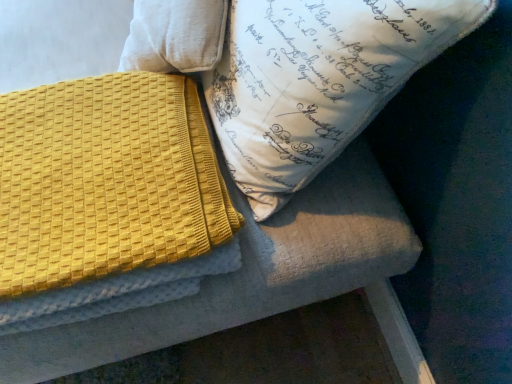
Identify the location of yellow textured blanket at upper left. The width and height of the screenshot is (512, 384). (108, 199).

Image resolution: width=512 pixels, height=384 pixels. What do you see at coordinates (108, 199) in the screenshot?
I see `yellow textured blanket at upper left` at bounding box center [108, 199].

Find the location of a particular element. white printed pillow at upper center is located at coordinates (317, 80).

What do you see at coordinates (317, 80) in the screenshot? Image resolution: width=512 pixels, height=384 pixels. I see `white printed pillow at upper center` at bounding box center [317, 80].

This screenshot has width=512, height=384. I want to click on yellow textured blanket at upper left, so click(108, 199).

Between yellow textured blanket at upper left and white printed pillow at upper center, which one appears on the left side from the viewer's perspective?

From the viewer's perspective, yellow textured blanket at upper left appears more on the left side.

Looking at this image, is yellow textured blanket at upper left further to camera compared to white printed pillow at upper center?

Yes, yellow textured blanket at upper left is further from the viewer.

Is point (97, 83) positioned in front of point (465, 35)?

No, (97, 83) is behind (465, 35).

From the image's perspective, which one is positioned lower, yellow textured blanket at upper left or white printed pillow at upper center?

From the image's view, yellow textured blanket at upper left is below.

From a real-world perspective, is yellow textured blanket at upper left positioned over white printed pillow at upper center based on gravity?

Incorrect, from a real-world perspective, yellow textured blanket at upper left is lower than white printed pillow at upper center.

Which object is wider, yellow textured blanket at upper left or white printed pillow at upper center?

yellow textured blanket at upper left.

Which of these two, yellow textured blanket at upper left or white printed pillow at upper center, stands shorter?

With less height is yellow textured blanket at upper left.

Considering the sizes of objects yellow textured blanket at upper left and white printed pillow at upper center in the image provided, who is smaller, yellow textured blanket at upper left or white printed pillow at upper center?

With smaller size is yellow textured blanket at upper left.

Is yellow textured blanket at upper left located outside white printed pillow at upper center?

That's correct, yellow textured blanket at upper left is outside of white printed pillow at upper center.

Is there a large distance between yellow textured blanket at upper left and white printed pillow at upper center?

They are positioned close to each other.

Does yellow textured blanket at upper left turn towards white printed pillow at upper center?

No, yellow textured blanket at upper left does not turn towards white printed pillow at upper center.

I want to click on pillow above the yellow textured blanket at upper left (from a real-world perspective), so click(x=317, y=80).

Between white printed pillow at upper center and yellow textured blanket at upper left, which one appears on the right side from the viewer's perspective?

white printed pillow at upper center is more to the right.

Is the position of white printed pillow at upper center less distant than that of yellow textured blanket at upper left?

Yes, it is.

Which point is more forward, (247, 67) or (165, 164)?

Positioned in front is point (247, 67).

From the image's perspective, which is above, white printed pillow at upper center or yellow textured blanket at upper left?

white printed pillow at upper center is shown above in the image.

From a real-world perspective, between white printed pillow at upper center and yellow textured blanket at upper left, who is vertically higher?

white printed pillow at upper center.

Which object is thinner, white printed pillow at upper center or yellow textured blanket at upper left?

white printed pillow at upper center is thinner.

Considering the relative sizes of white printed pillow at upper center and yellow textured blanket at upper left in the image provided, is white printed pillow at upper center shorter than yellow textured blanket at upper left?

In fact, white printed pillow at upper center may be taller than yellow textured blanket at upper left.

Looking at the image, does white printed pillow at upper center seem bigger or smaller compared to yellow textured blanket at upper left?

Clearly, white printed pillow at upper center is larger in size than yellow textured blanket at upper left.

Is white printed pillow at upper center not within yellow textured blanket at upper left?

white printed pillow at upper center is positioned outside yellow textured blanket at upper left.

Is white printed pillow at upper center far away from yellow textured blanket at upper left?

No, white printed pillow at upper center is not far from yellow textured blanket at upper left.

Is white printed pillow at upper center oriented towards yellow textured blanket at upper left?

Yes, white printed pillow at upper center faces towards yellow textured blanket at upper left.

Measure the distance between white printed pillow at upper center and yellow textured blanket at upper left.

The distance of white printed pillow at upper center from yellow textured blanket at upper left is 23.62 centimeters.

Find the location of a particular element. blanket below the white printed pillow at upper center (from a real-world perspective) is located at coordinates click(x=108, y=199).

Image resolution: width=512 pixels, height=384 pixels. Find the location of `pillow that appears on the right of yellow textured blanket at upper left`. pillow that appears on the right of yellow textured blanket at upper left is located at coordinates (317, 80).

Where is `pillow that is in front of the yellow textured blanket at upper left`? This screenshot has height=384, width=512. pillow that is in front of the yellow textured blanket at upper left is located at coordinates (317, 80).